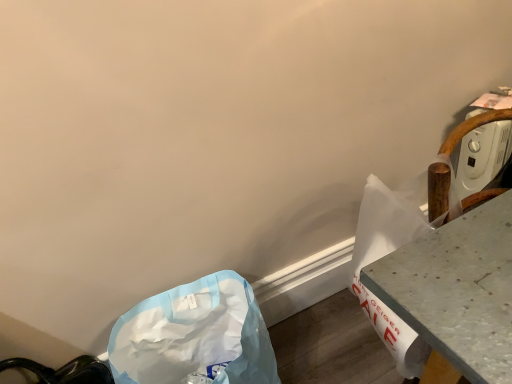
Question: Is blue plastic bag at lower left to the left or to the right of metallic gray table at right in the image?

Choices:
 (A) left
 (B) right

Answer: (A)

Question: Looking at the image, does blue plastic bag at lower left seem bigger or smaller compared to metallic gray table at right?

Choices:
 (A) small
 (B) big

Answer: (A)

Question: From the image's perspective, is blue plastic bag at lower left located above or below metallic gray table at right?

Choices:
 (A) above
 (B) below

Answer: (B)

Question: Is metallic gray table at right inside the boundaries of blue plastic bag at lower left, or outside?

Choices:
 (A) inside
 (B) outside

Answer: (B)

Question: From the image's perspective, is metallic gray table at right located above or below blue plastic bag at lower left?

Choices:
 (A) above
 (B) below

Answer: (A)

Question: Based on their sizes in the image, would you say metallic gray table at right is bigger or smaller than blue plastic bag at lower left?

Choices:
 (A) big
 (B) small

Answer: (A)

Question: In the image, is metallic gray table at right positioned in front of or behind blue plastic bag at lower left?

Choices:
 (A) front
 (B) behind

Answer: (A)